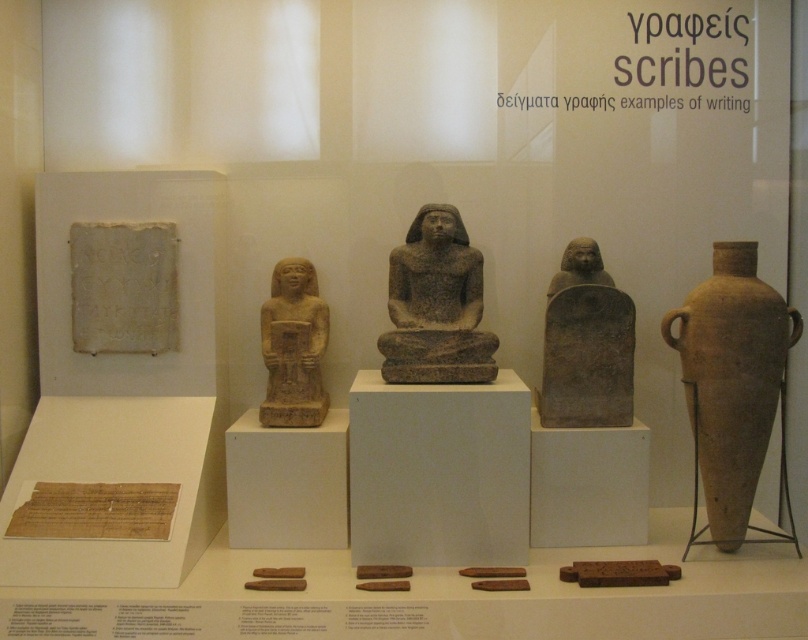
You are an archaeologist examining the museum display case. You need to determine which object is bigger between the brown matte vase at right and the gray stone statue at center. Which one is larger?

The brown matte vase at right is larger in size than the gray stone statue at center, so the brown matte vase at right is the larger one.

You are standing in front of the museum display case and want to take a photo of the two points inside the case. Which point, point at coordinates (444, 317) or point at coordinates (310, 397), will appear closer to you in the photo?

Point at coordinates (444, 317) will appear closer to you in the photo because it is closer to the camera than point at coordinates (310, 397).